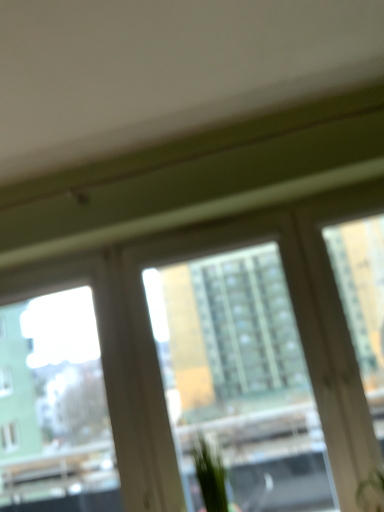
Question: Does point (359, 496) appear closer or farther from the camera than point (71, 470)?

Choices:
 (A) farther
 (B) closer

Answer: (B)

Question: Considering the relative positions of green matte plant at lower right, placed as the first plant when sorted from right to left, and transparent glass window screen at left in the image provided, is green matte plant at lower right, placed as the first plant when sorted from right to left, to the left or to the right of transparent glass window screen at left?

Choices:
 (A) left
 (B) right

Answer: (B)

Question: Which object is positioned closest to the green leafy plant at center, which is the 1th plant from left to right?

Choices:
 (A) green matte plant at lower right, placed as the first plant when sorted from right to left
 (B) transparent glass window screen at left
 (C) transparent glass window at center

Answer: (C)

Question: Which of these objects is positioned closest to the green matte plant at lower right, placed as the first plant when sorted from right to left?

Choices:
 (A) green leafy plant at center, which is the 1th plant from left to right
 (B) transparent glass window screen at left
 (C) transparent glass window at center

Answer: (A)